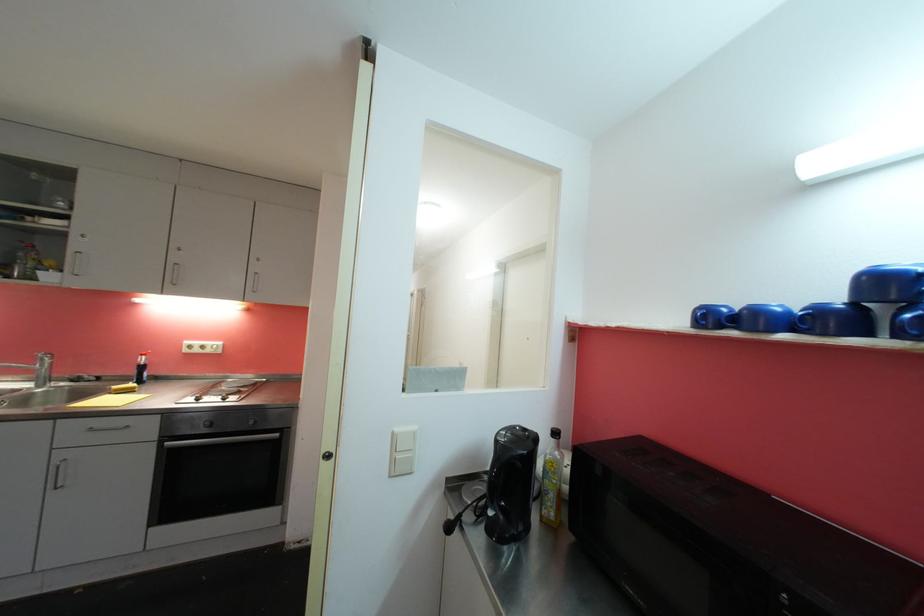
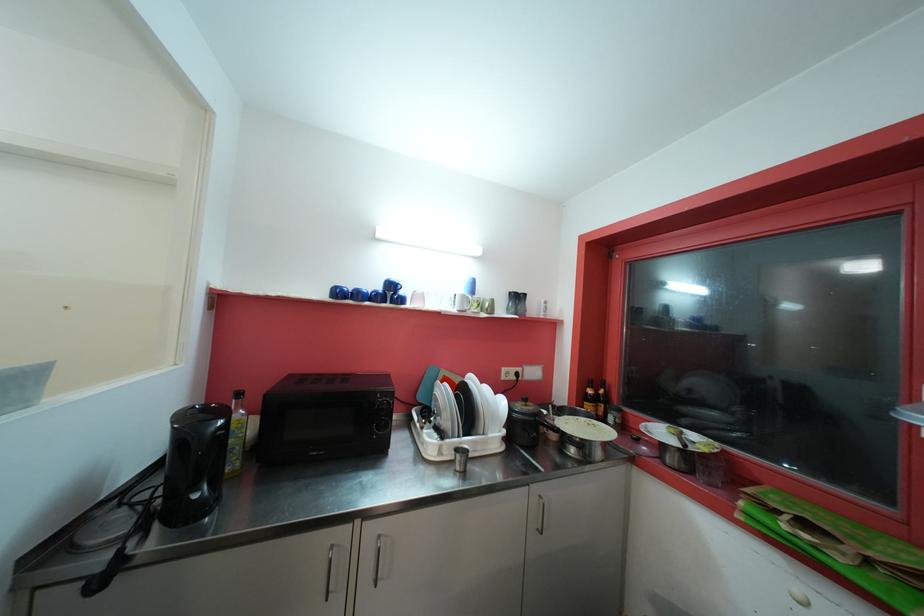
In the second image, find the point that corresponds to point 560,476 in the first image.

(247, 430)